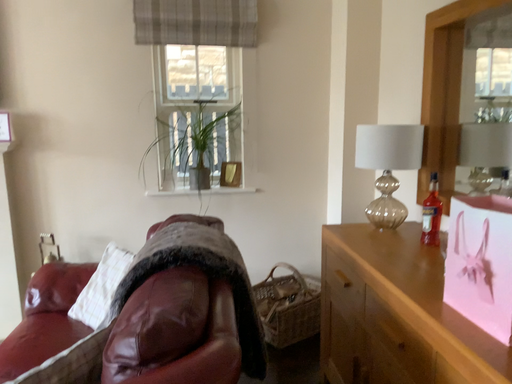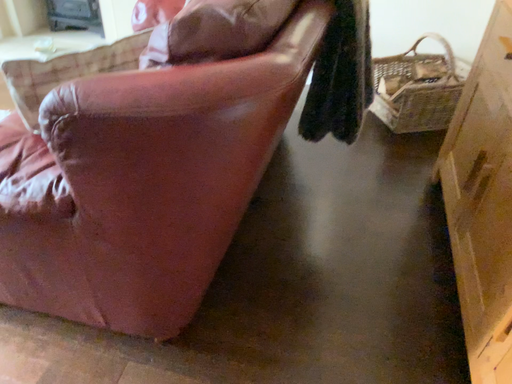
Question: Which way did the camera rotate in the video?

Choices:
 (A) rotated left
 (B) rotated right

Answer: (A)